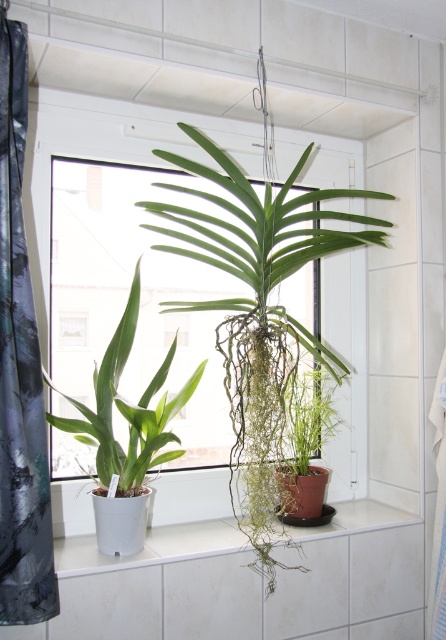
Question: Can you confirm if green leafy plant at center is positioned to the right of black matte shower curtain at left?

Choices:
 (A) no
 (B) yes

Answer: (B)

Question: Which point is closer to the camera taking this photo?

Choices:
 (A) (86, 324)
 (B) (168, 540)
 (C) (235, 392)
 (D) (69, 349)

Answer: (B)

Question: Does green leafy plant at center appear on the left side of white ceramic window sill at center?

Choices:
 (A) yes
 (B) no

Answer: (A)

Question: Does green leafy plant at center appear over black matte shower curtain at left?

Choices:
 (A) no
 (B) yes

Answer: (B)

Question: Considering the real-world distances, which object is farthest from the green glossy leafy plant at center?

Choices:
 (A) white ceramic window sill at center
 (B) green leafy plant at center
 (C) black matte shower curtain at left
 (D) transparent glass window at center

Answer: (D)

Question: Which object appears closest to the camera in this image?

Choices:
 (A) green glossy leafy plant at center
 (B) white ceramic window sill at center

Answer: (A)